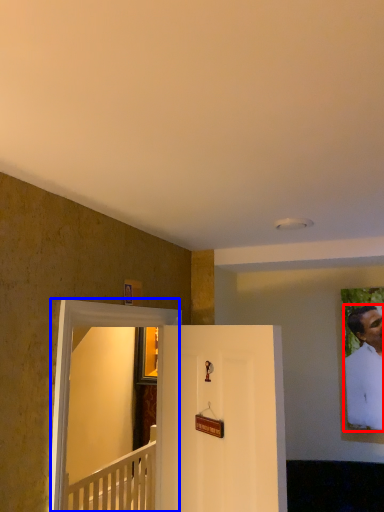
Question: Which of the following is the farthest to the observer, man (highlighted by a red box) or glass door (highlighted by a blue box)?

Choices:
 (A) man
 (B) glass door

Answer: (A)